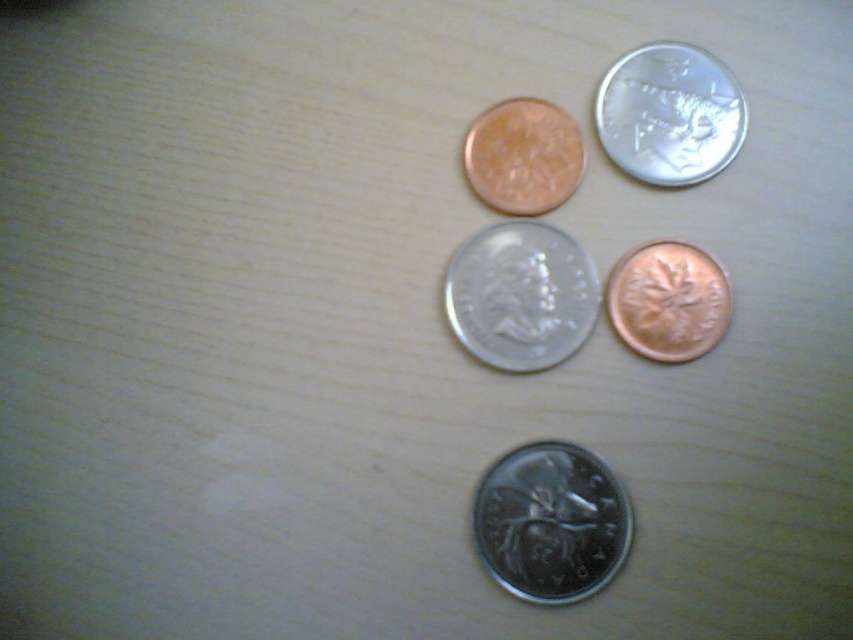
You are standing at the silver metallic coin at center. There is a copper coin with maple leaf at top left and a silver coin with profile at top right. Which direction should you move to reach the nearest coin?

The nearest coin is the copper coin with maple leaf at top left or the silver coin with profile at top right, but since they are both 1.10 meters away from the silver metallic coin at center, you can choose either direction as they are equidistant.

You are standing at the center of the wooden surface where the coins are placed. You want to pick up the coin located at point (x=560, y=515) first and then the one at point (x=637, y=65). Which direction should you move first to reach the first coin?

Since point (x=560, y=515) is in front of point (x=637, y=65), you should move forward to reach the coin at point (x=560, y=515) first.